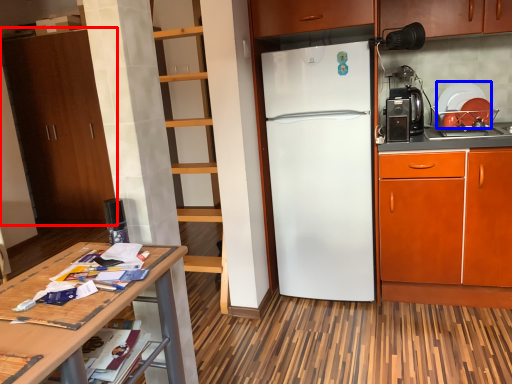
Question: Which of the following is the closest to the observer, cabinetry (highlighted by a red box) or appliance (highlighted by a blue box)?

Choices:
 (A) cabinetry
 (B) appliance

Answer: (B)